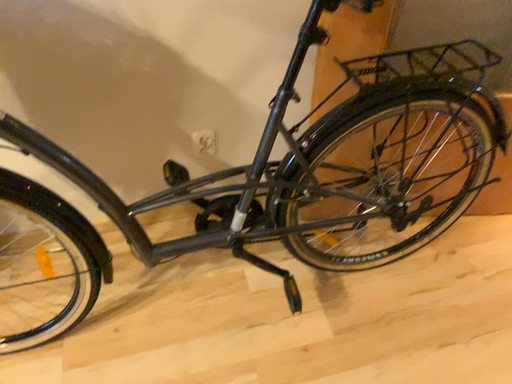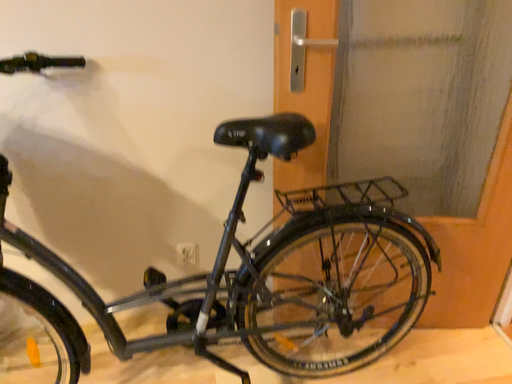
Question: How did the camera likely rotate when shooting the video?

Choices:
 (A) rotated upward
 (B) rotated downward

Answer: (A)